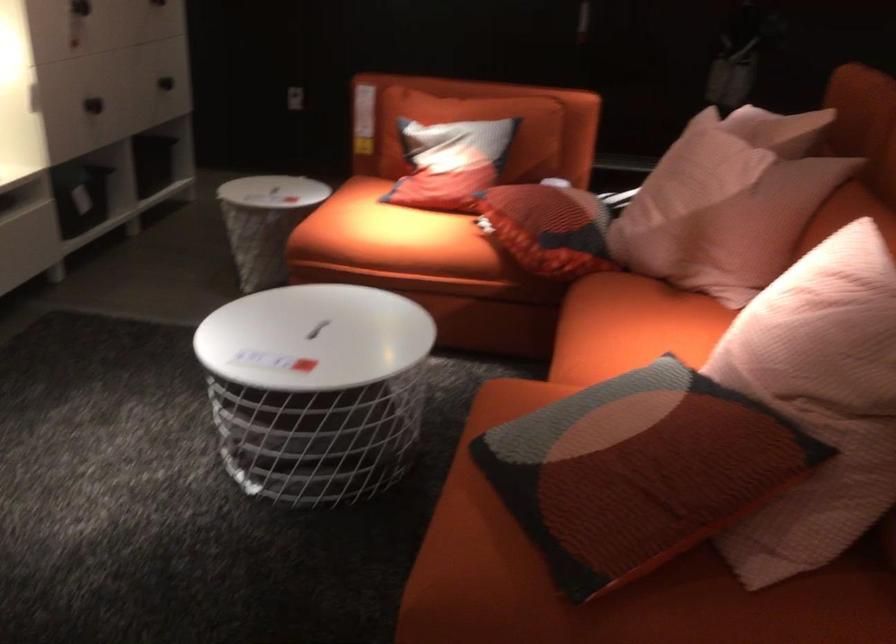
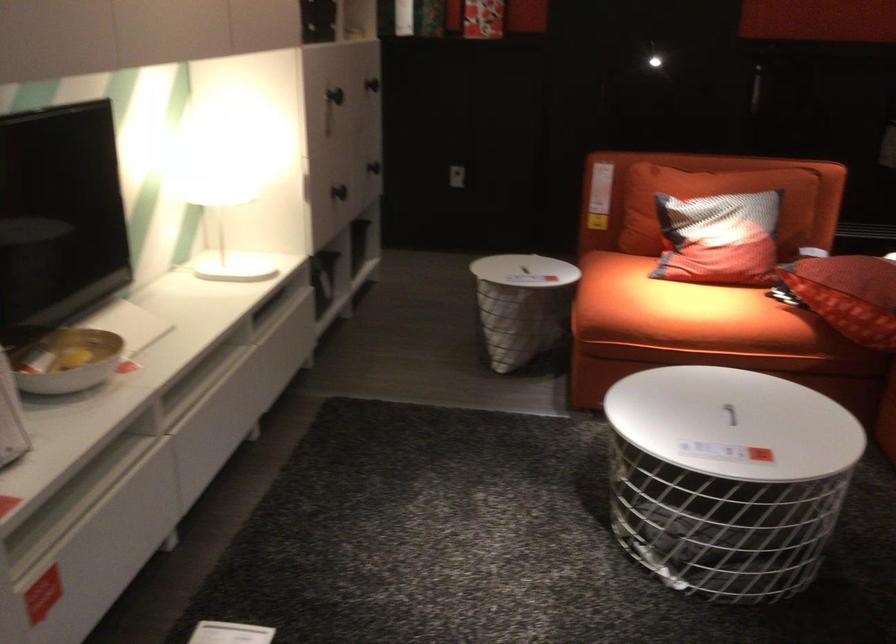
In the second image, find the point that corresponds to pixel 435 169 in the first image.

(719, 239)